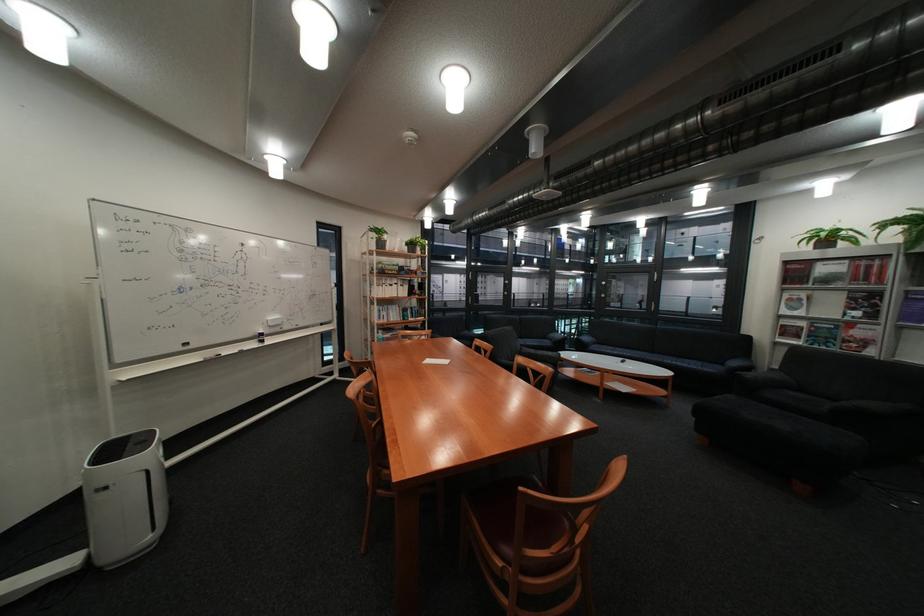
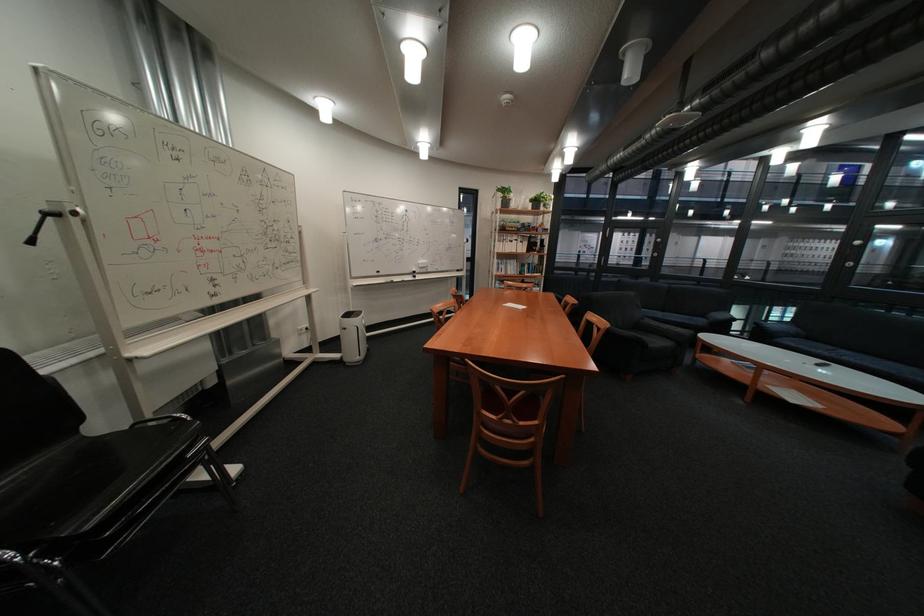
Find the pixel in the second image that matches the point at 614,350 in the first image.

(808, 345)